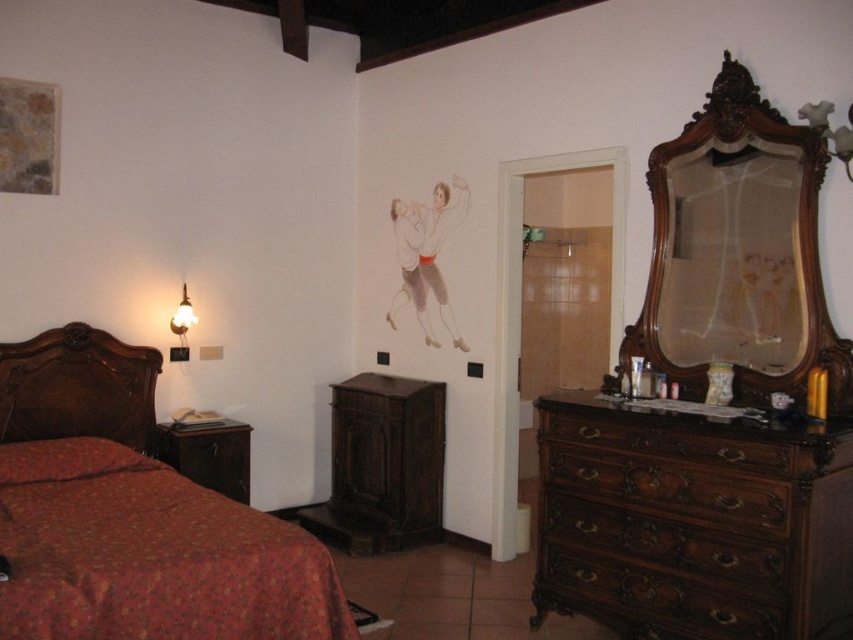
You are an interior designer assessing the layout of this vintage bedroom. The wooden mirror at right and the dark brown wood cabinet at center are both in the room. Which object would cast a larger shadow on the wall when the room is lit by a single light source directly above them?

The wooden mirror at right is much taller than the dark brown wood cabinet at center, so it would cast a larger shadow on the wall.